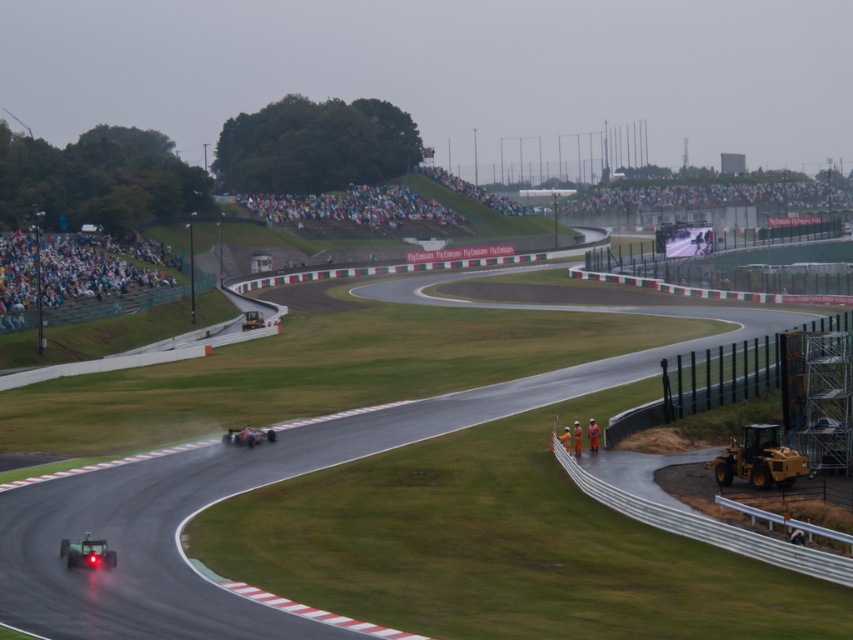
Question: Does yellow metallic race car at lower right have a smaller size compared to shiny silver race car at center?

Choices:
 (A) no
 (B) yes

Answer: (B)

Question: Does smooth asphalt race track at center have a greater width compared to green matte race car at lower left?

Choices:
 (A) yes
 (B) no

Answer: (A)

Question: Which of these objects is positioned farthest from the shiny silver race car at center?

Choices:
 (A) shiny metallic race car at center
 (B) yellow metallic race car at lower right
 (C) green matte race car at lower left

Answer: (C)

Question: Estimate the real-world distances between objects in this image. Which object is closer to the shiny silver race car at center?

Choices:
 (A) green matte race car at lower left
 (B) smooth asphalt race track at center

Answer: (B)

Question: Which object appears farthest from the camera in this image?

Choices:
 (A) shiny silver race car at center
 (B) yellow metallic race car at lower right
 (C) shiny metallic race car at center

Answer: (A)

Question: Does smooth asphalt race track at center appear over yellow metallic race car at lower right?

Choices:
 (A) yes
 (B) no

Answer: (A)